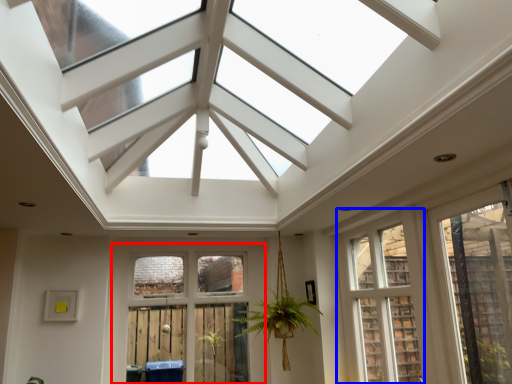
Question: Which of the following is the closest to the observer, window (highlighted by a red box) or window (highlighted by a blue box)?

Choices:
 (A) window
 (B) window

Answer: (B)